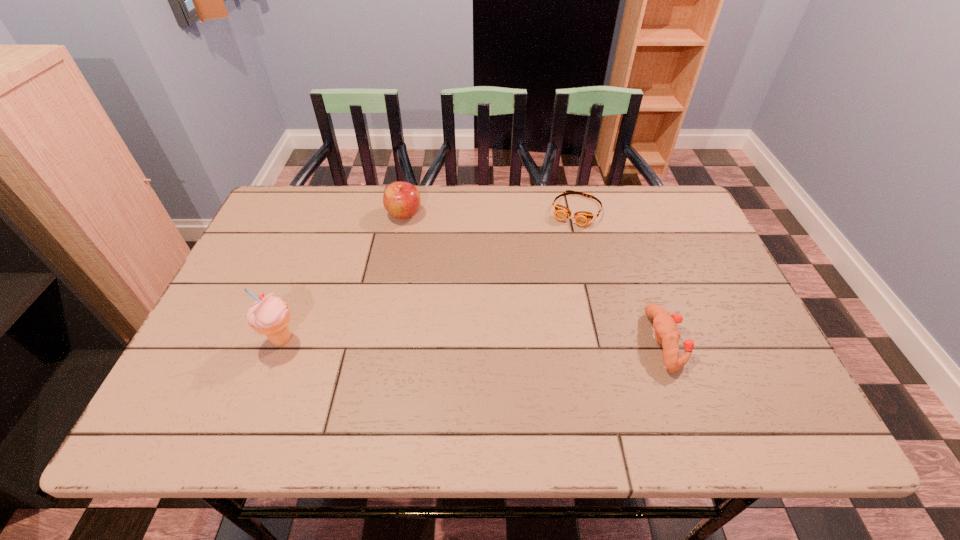
Locate an element on the screen. free region that satisfies the following two spatial constraints: 1. on the front side of the leftmost object; 2. with the gloves of the second shortest object facing forward is located at coordinates (281, 342).